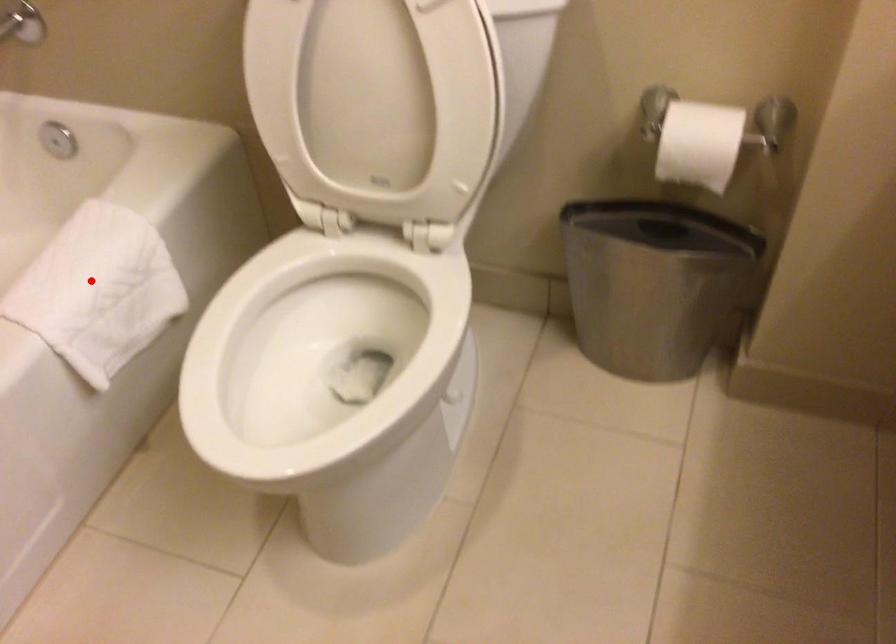
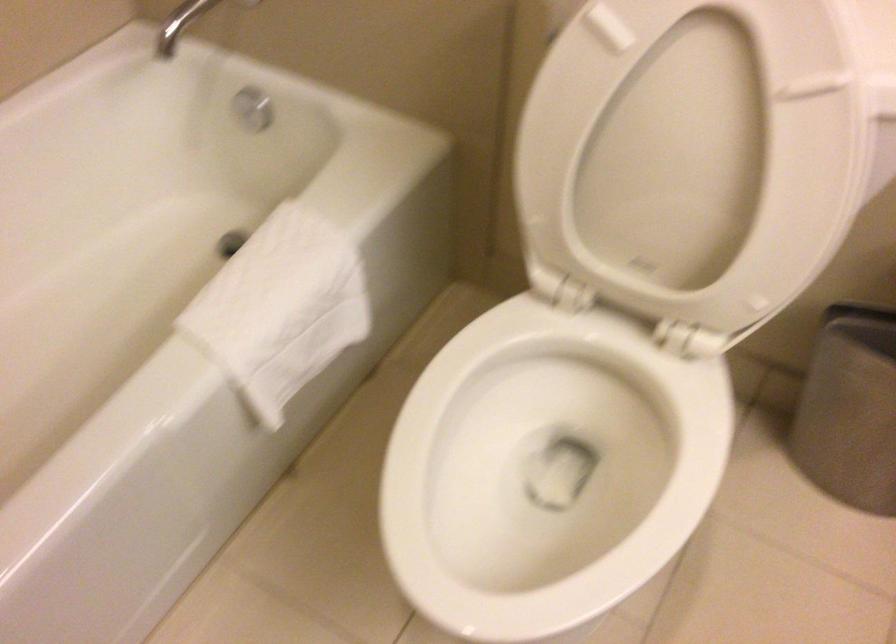
Question: I am providing you with two images of the same scene from different viewpoints. Given a red point in image1, look at the same physical point in image2. Is it:

Choices:
 (A) Closer to the viewpoint
 (B) Farther from the viewpoint

Answer: (A)